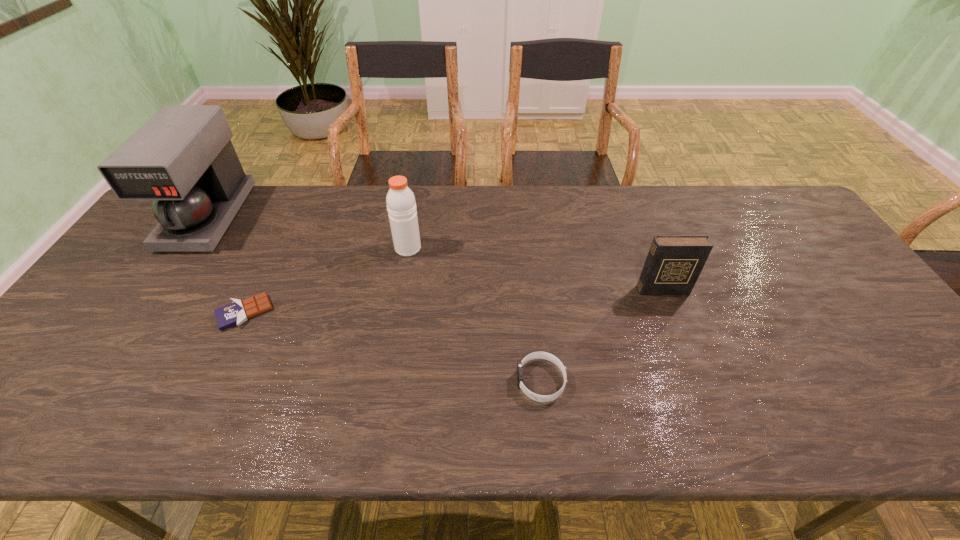
I want to click on free space located on the carafe side of the coffee maker, so [x=124, y=341].

Where is `vacant point located 0.240m on the back of the third object from right to left`? This screenshot has width=960, height=540. vacant point located 0.240m on the back of the third object from right to left is located at coordinates (418, 193).

The image size is (960, 540). What are the coordinates of `free region located on the front cover of the third tallest object` in the screenshot? It's located at (688, 359).

Identify the location of vacant area situated 0.150m on the outer surface of the wristband. (451, 381).

Identify the location of vacant space located on the outer surface of the wristband. (434, 381).

In order to click on free location located on the outer surface of the wristband in this screenshot , I will do `click(407, 381)`.

Identify the location of free region located 0.270m on the front of the shortest object. (185, 437).

Image resolution: width=960 pixels, height=540 pixels. Find the location of `object situated at the far edge`. object situated at the far edge is located at coordinates (182, 158).

This screenshot has height=540, width=960. Identify the location of object that is positioned at the near edge. (535, 355).

The image size is (960, 540). Identify the location of object that is at the left edge. (182, 158).